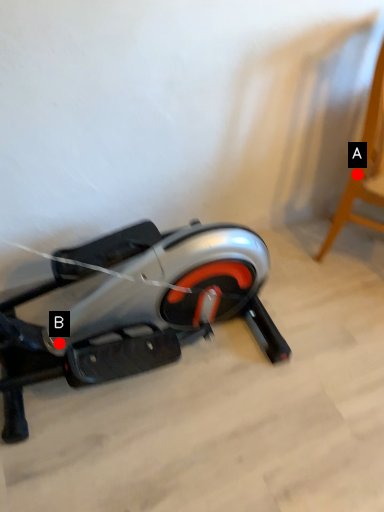
Question: Two points are circled on the image, labeled by A and B beside each circle. Among these points, which one is nearest to the camera?

Choices:
 (A) A is closer
 (B) B is closer

Answer: (B)